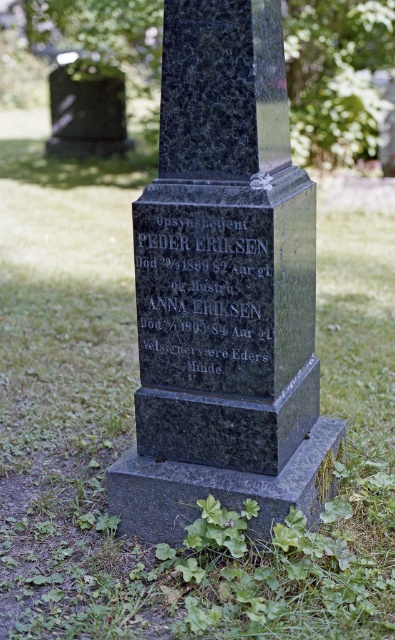
Consider the image. What is the relationship between the sizes of the green polished stone monument at center and the black granite stone at center in the image?

The green polished stone monument at center is larger in size than the black granite stone at center.

You are standing in a cemetery and see both the green polished stone monument at center and the black granite stone at center. Which one is located to the right of the other?

The green polished stone monument at center is positioned on the right side of black granite stone at center.